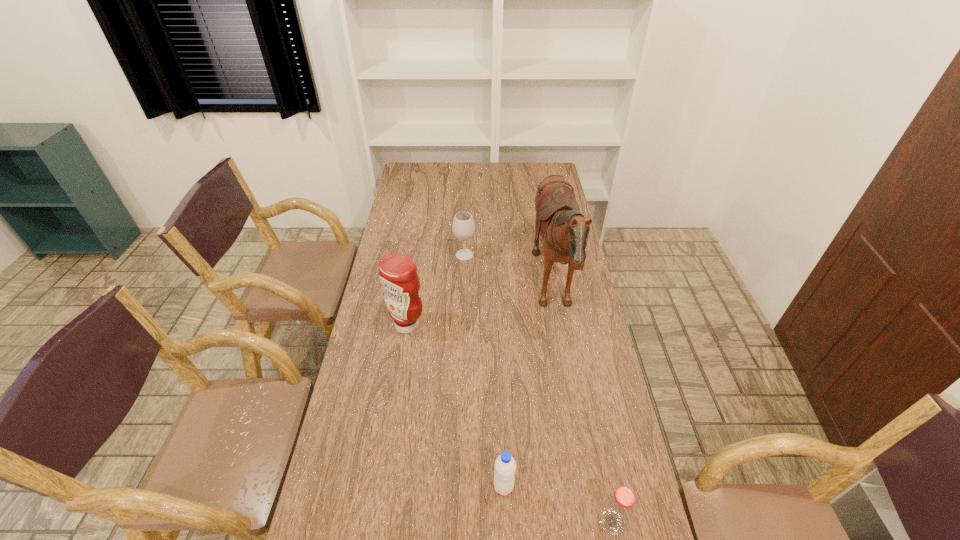
Where is `blank area located 0.310m on the back of the fourth shortest object`? Image resolution: width=960 pixels, height=540 pixels. blank area located 0.310m on the back of the fourth shortest object is located at coordinates (418, 258).

The image size is (960, 540). What are the coordinates of `free region located 0.200m on the front of the wineglass` in the screenshot? It's located at (463, 296).

Locate an element on the screen. free region located on the right of the third object from left to right is located at coordinates (608, 487).

You are a GUI agent. You are given a task and a screenshot of the screen. Output one action in this format:
    pyautogui.click(x=<x>, y=<y>)
    Task: Click on the free space located on the left of the bottle
    
    Given the screenshot: What is the action you would take?
    pyautogui.click(x=563, y=522)

Identify the location of object positioned at the left edge. (398, 275).

This screenshot has height=540, width=960. I want to click on saddle that is positioned at the right edge, so click(x=564, y=230).

Find the location of `bottle at the right edge`. bottle at the right edge is located at coordinates (617, 510).

You are a GUI agent. You are given a task and a screenshot of the screen. Output one action in this format:
    pyautogui.click(x=<x>, y=<y>)
    Task: Click on the free space at the left edge of the desktop
    The image size is (960, 540).
    Given the screenshot: What is the action you would take?
    pyautogui.click(x=390, y=325)

Locate an element on the screen. The height and width of the screenshot is (540, 960). vacant region at the right edge of the desktop is located at coordinates (579, 437).

At what (x,y) coordinates should I click in order to perform the action: click on free point between the condiment and the wineglass. Please return your answer as a coordinate pair (x, y). This screenshot has width=960, height=540. Looking at the image, I should click on (436, 290).